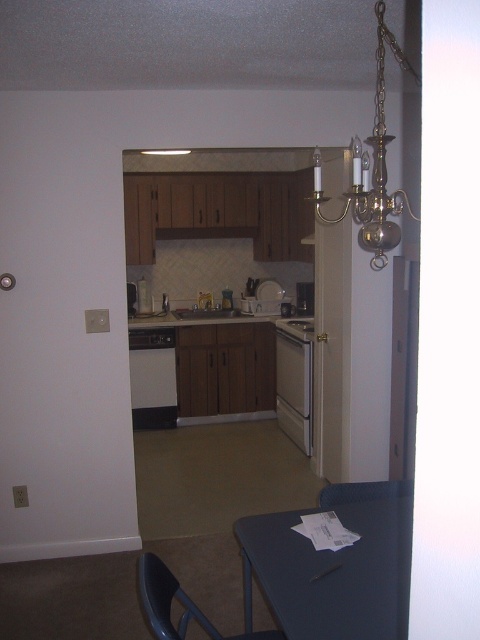
Question: Is satin white oven at center above matte black chair at lower center?

Choices:
 (A) no
 (B) yes

Answer: (B)

Question: Which point appears closest to the camera in this image?

Choices:
 (A) (351, 484)
 (B) (398, 525)
 (C) (300, 291)

Answer: (B)

Question: Which object appears closest to the camera in this image?

Choices:
 (A) white glossy dishwasher at center
 (B) gold brass chandelier at upper center

Answer: (B)

Question: Where is blue plastic table at lower center located in relation to white glossy stove at center in the image?

Choices:
 (A) left
 (B) right

Answer: (A)

Question: Does black plastic chair at lower center have a greater width compared to matte black chair at lower center?

Choices:
 (A) no
 (B) yes

Answer: (B)

Question: Among these points, which one is farthest from the camera?

Choices:
 (A) (292, 378)
 (B) (213, 308)
 (C) (328, 493)
 (D) (386, 230)

Answer: (B)